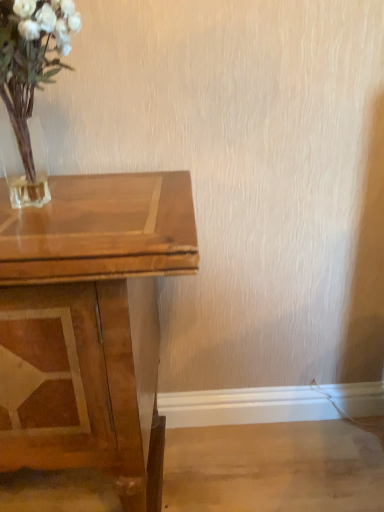
Locate an element on the screen. The height and width of the screenshot is (512, 384). free space to the back side of translucent glass vase at upper left is located at coordinates (98, 179).